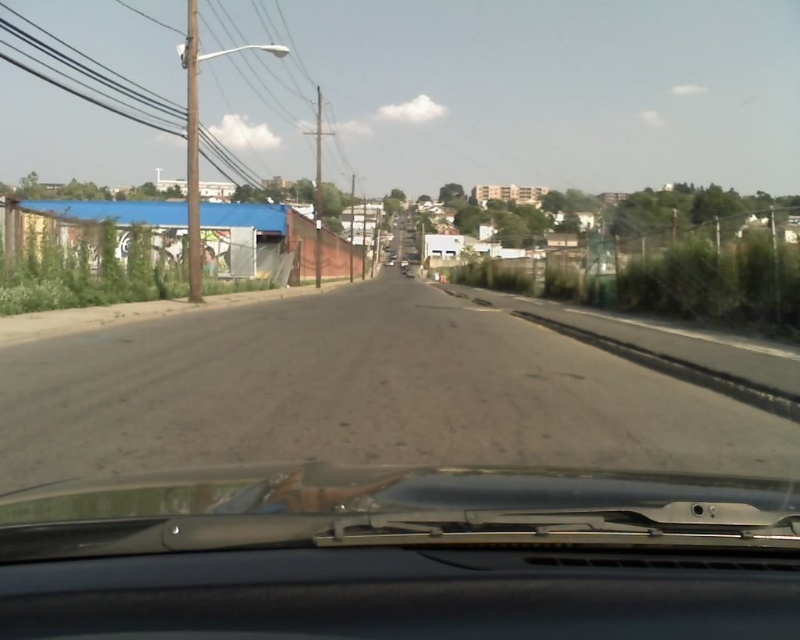
Does black rubber windshield wiper at lower center come in front of dirt track at lower left?

That is True.

Who is positioned more to the left, black rubber windshield wiper at lower center or dirt track at lower left?

From the viewer's perspective, dirt track at lower left appears more on the left side.

Is point (356, 566) positioned before point (230, 323)?

Yes.

Find the location of a particular element. This screenshot has width=800, height=640. black rubber windshield wiper at lower center is located at coordinates (400, 554).